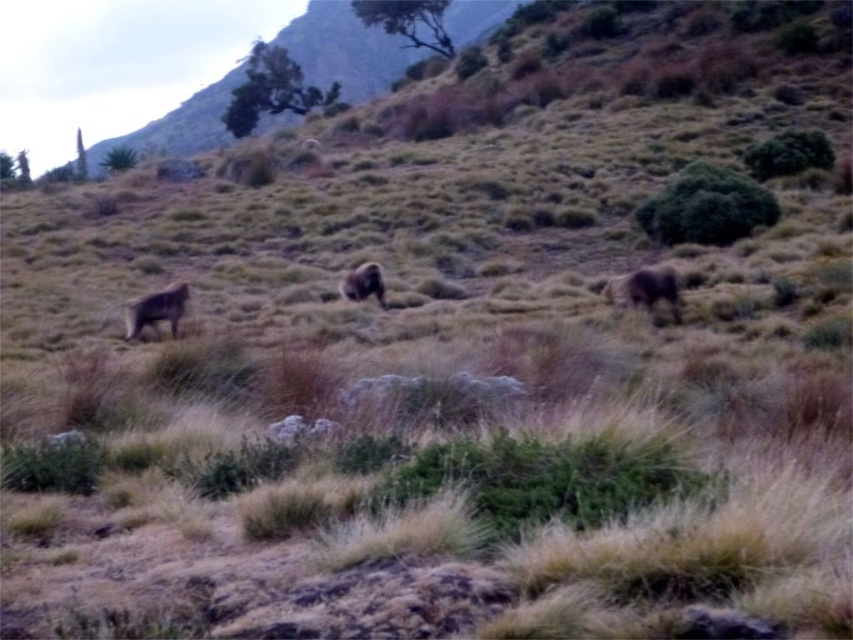
Between point (668, 268) and point (364, 280), which one is positioned behind?

Point (364, 280)

Is brown furry animal at right positioned behind brown furry animal at center?

No.

Does point (635, 284) lie in front of point (378, 269)?

Yes, point (635, 284) is in front of point (378, 269).

Identify the location of brown furry animal at right. (645, 289).

The height and width of the screenshot is (640, 853). What do you see at coordinates (155, 308) in the screenshot?
I see `fuzzy brown bear at lower left` at bounding box center [155, 308].

Between fuzzy brown bear at lower left and brown furry animal at center, which one has less height?

brown furry animal at center is shorter.

Between point (160, 292) and point (347, 289), which one is positioned in front?

Point (160, 292) is more forward.

At what (x,y) coordinates should I click in order to perform the action: click on fuzzy brown bear at lower left. Please return your answer as a coordinate pair (x, y). Image resolution: width=853 pixels, height=640 pixels. Looking at the image, I should click on [x=155, y=308].

Who is taller, dry grass at upper center or brown furry animal at center?

dry grass at upper center

Does dry grass at upper center have a greater width compared to brown furry animal at center?

Correct, the width of dry grass at upper center exceeds that of brown furry animal at center.

Which is in front, point (332, 1) or point (347, 272)?

Point (347, 272) is more forward.

Locate an element on the screen. The height and width of the screenshot is (640, 853). dry grass at upper center is located at coordinates (344, 51).